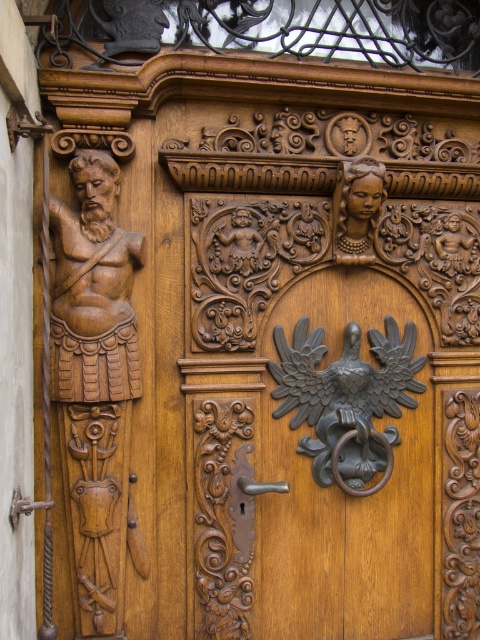
Is wooden carving at upper center shorter than polished brass door handle at lower left?

Incorrect, wooden carving at upper center's height does not fall short of polished brass door handle at lower left's.

This screenshot has height=640, width=480. Describe the element at coordinates (358, 209) in the screenshot. I see `wooden carving at upper center` at that location.

Where is `wooden carving at upper center`? This screenshot has width=480, height=640. wooden carving at upper center is located at coordinates (358, 209).

Does wooden carving at left appear under wooden carving at upper center?

Correct, wooden carving at left is located below wooden carving at upper center.

Between wooden carving at left and wooden carving at upper center, which one is positioned higher?

wooden carving at upper center is above.

Which is in front, point (76, 237) or point (336, 230)?

Point (76, 237) is more forward.

Where is `wooden carving at left`? wooden carving at left is located at coordinates (94, 288).

Which is behind, point (336, 387) or point (274, 484)?

The point (336, 387) is more distant.

Does polished bronze eagle at center lie behind polished silver door handle at center?

Yes.

The height and width of the screenshot is (640, 480). In order to click on polished bronze eagle at center in this screenshot , I will do `click(345, 394)`.

In order to click on polished bronze eagle at center in this screenshot , I will do `click(345, 394)`.